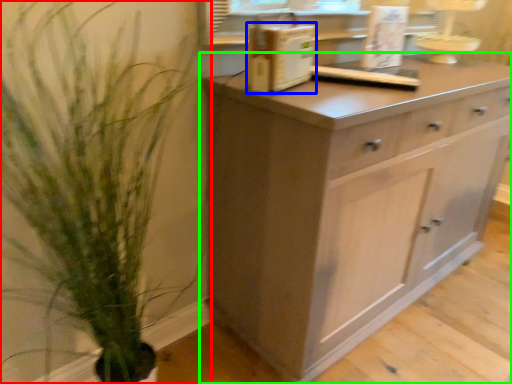
Question: Which object is positioned closest to houseplant (highlighted by a red box)? Select from appliance (highlighted by a blue box) and chest of drawers (highlighted by a green box).

Choices:
 (A) appliance
 (B) chest of drawers

Answer: (B)